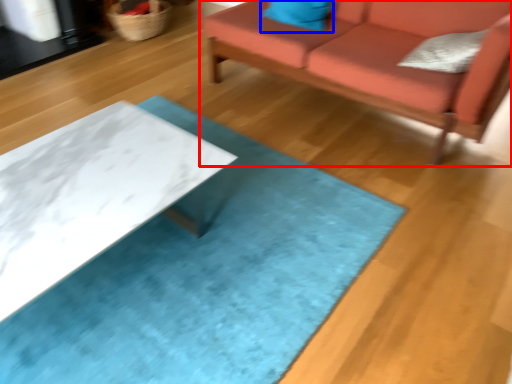
Question: Which of the following is the farthest to the observer, studio couch (highlighted by a red box) or pillow (highlighted by a blue box)?

Choices:
 (A) studio couch
 (B) pillow

Answer: (B)